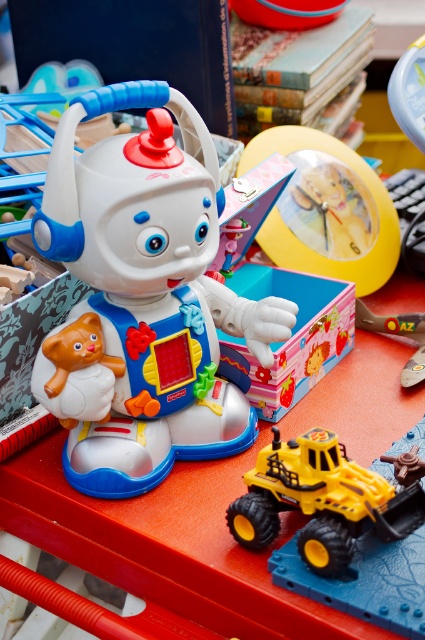
You are a child trying to stack the yellow rubber toy truck at lower center and the matte plastic clock at center. Which one should you place at the bottom to make the stack stable?

The yellow rubber toy truck at lower center has a lesser height compared to matte plastic clock at center, so you should place the matte plastic clock at center at the bottom to make the stack stable since it is taller and provides a more stable base.

You are organizing a child play area and need to place the plastic toy robot at center and the yellow plastic clock at center. According to the image, which object is positioned to the right?

The yellow plastic clock at center is positioned to the right of the plastic toy robot at center.